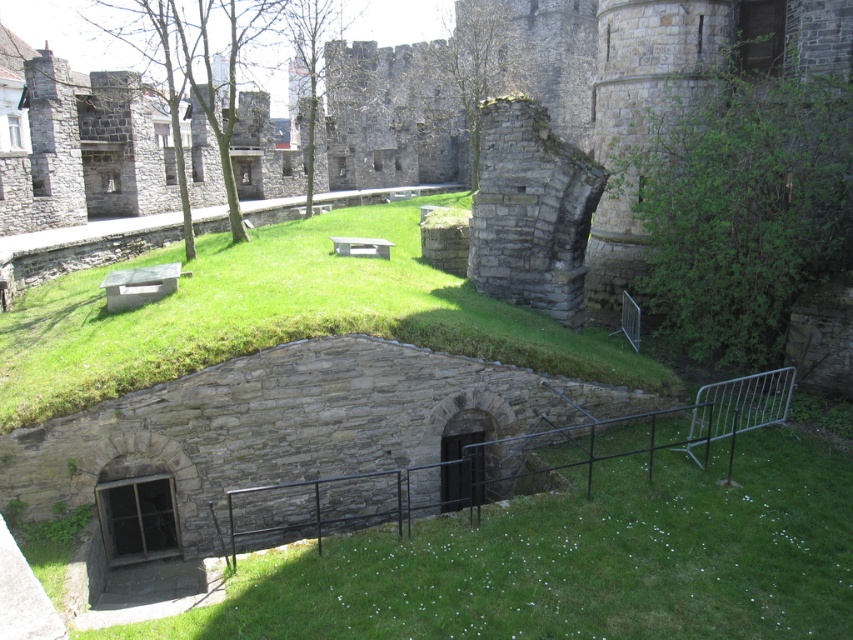
You are standing in front of the historic stone structure and want to take a photo. You notice two points marked as point 1 at coordinates (368,560) and point 2 at coordinates (155,352). Which point will appear larger in your photo?

Point 1 at coordinates (368,560) will appear larger in the photo because it is closer to the viewer than point 2 at coordinates (155,352).

In the scene shown: You are standing at the point marked by the coordinates point (578, 561) in the image. Based on the scene described, what type of terrain are you currently standing on?

The point (578, 561) corresponds to the green grassy area at lower center, so you are standing on grass.